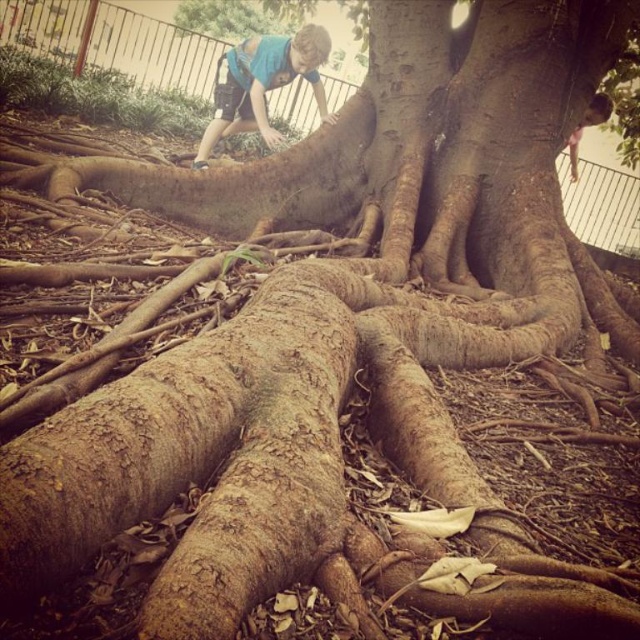
Question: Among these objects, which one is farthest from the camera?

Choices:
 (A) blue cotton shirt at upper center
 (B) brown textured hair at upper right

Answer: (B)

Question: From the image, what is the correct spatial relationship of blue cotton shirt at upper center in relation to brown textured hair at upper right?

Choices:
 (A) above
 (B) below

Answer: (A)

Question: Can you confirm if blue cotton shirt at upper center is positioned to the right of brown textured hair at upper right?

Choices:
 (A) yes
 (B) no

Answer: (B)

Question: Considering the relative positions of blue cotton shirt at upper center and brown textured hair at upper right in the image provided, where is blue cotton shirt at upper center located with respect to brown textured hair at upper right?

Choices:
 (A) right
 (B) left

Answer: (B)

Question: Which of the following is the closest to the observer?

Choices:
 (A) brown textured hair at upper right
 (B) blue cotton shirt at upper center

Answer: (B)